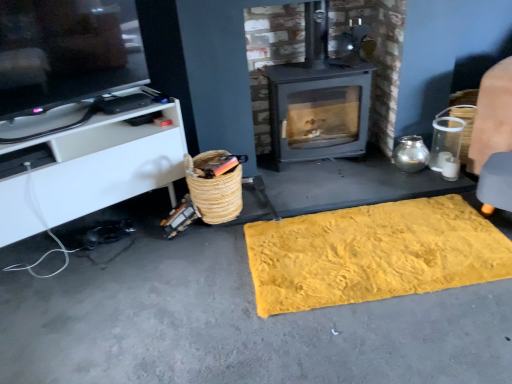
Find the location of a particular element. blank space situated above yellow textured rug at lower center (from a real-world perspective) is located at coordinates (268, 282).